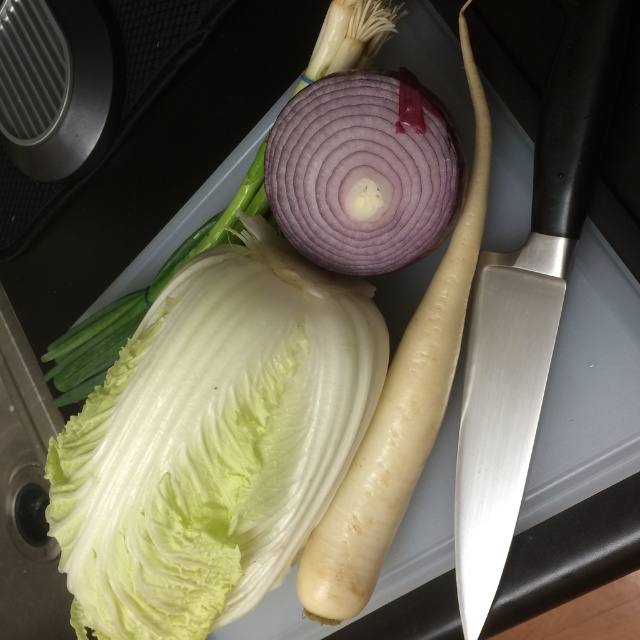
Does white crisp lettuce at center appear on the left side of green leafy cabbage at center?

No, white crisp lettuce at center is not to the left of green leafy cabbage at center.

Between white crisp lettuce at center and green leafy cabbage at center, which one appears on the right side from the viewer's perspective?

white crisp lettuce at center is more to the right.

Which is in front, point (166, 317) or point (324, 33)?

Positioned in front is point (166, 317).

Find the location of a particular element. This screenshot has width=640, height=640. white crisp lettuce at center is located at coordinates (212, 440).

Which of these two, satin silver knife at center right or purple matte onion at center, stands shorter?

With less height is purple matte onion at center.

Who is positioned more to the right, satin silver knife at center right or purple matte onion at center?

satin silver knife at center right is more to the right.

Who is more forward, (470, 518) or (268, 141)?

Point (470, 518) is more forward.

At what (x,y) coordinates should I click in order to perform the action: click on satin silver knife at center right. Please return your answer as a coordinate pair (x, y). This screenshot has width=640, height=640. Looking at the image, I should click on (525, 308).

Is purple smooth onion at center closer to camera compared to green leafy cabbage at center?

Yes, it is.

The image size is (640, 640). Identify the location of purple smooth onion at center. (401, 410).

This screenshot has height=640, width=640. What are the coordinates of `purple smooth onion at center` in the screenshot? It's located at (401, 410).